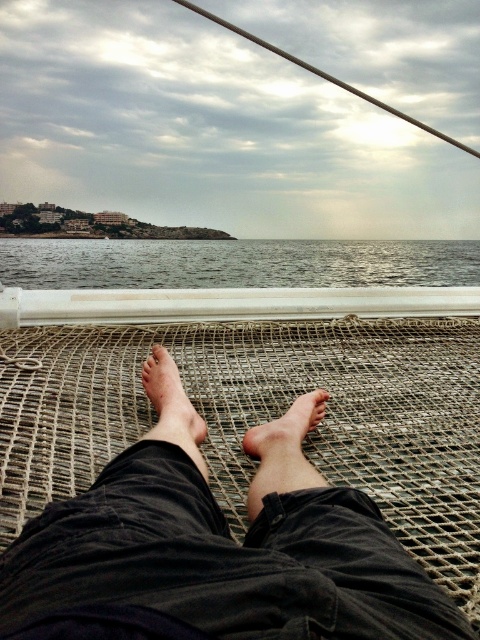
Question: Among these objects, which one is nearest to the camera?

Choices:
 (A) dark fabric legs at center
 (B) dry skin at center
 (C) brown rough skin at center

Answer: (A)

Question: Is dry skin at center closer to camera compared to brown rough skin at center?

Choices:
 (A) no
 (B) yes

Answer: (B)

Question: Does dark fabric legs at center have a larger size compared to brown rough skin at center?

Choices:
 (A) no
 (B) yes

Answer: (B)

Question: Which of the following is the closest to the observer?

Choices:
 (A) (162, 611)
 (B) (264, 440)
 (C) (220, 252)

Answer: (A)

Question: Which object is farther from the camera taking this photo?

Choices:
 (A) dry skin at center
 (B) brown rough skin at center

Answer: (B)

Question: Is gray water at center wider than brown rough skin at center?

Choices:
 (A) yes
 (B) no

Answer: (A)